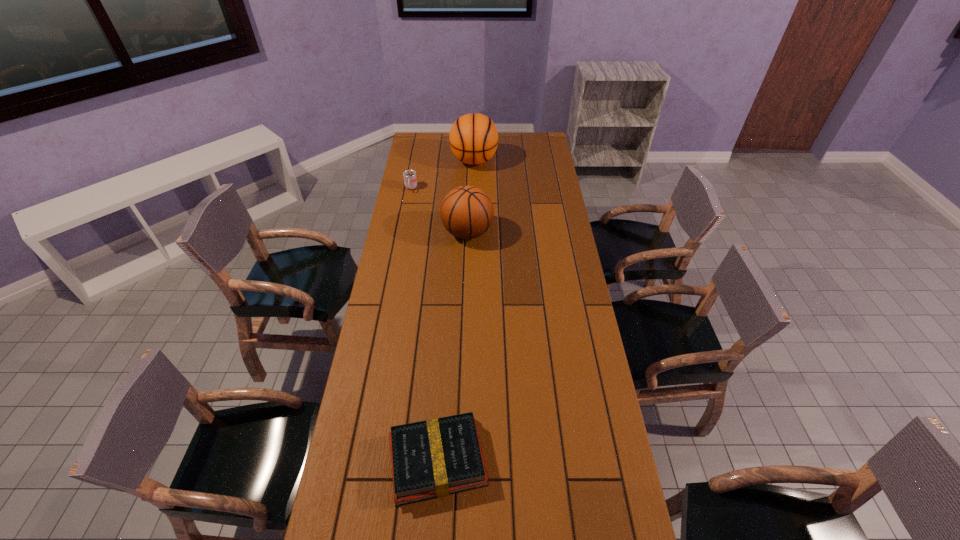
Where is `vacant point located between the hardback book and the second farthest object`? Image resolution: width=960 pixels, height=540 pixels. vacant point located between the hardback book and the second farthest object is located at coordinates (424, 324).

The image size is (960, 540). Identify the location of free area in between the nearer basketball and the leftmost object. (440, 210).

Locate an element on the screen. This screenshot has height=540, width=960. vacant area that lies between the nearest object and the second shortest object is located at coordinates (424, 324).

I want to click on free space between the farthest object and the third nearest object, so click(x=443, y=174).

Find the location of `the second closest object to the farthest object`. the second closest object to the farthest object is located at coordinates (467, 212).

Identify which object is the third nearest to the nearer basketball. Please provide its 2D coordinates. Your answer should be formatted as a tuple, i.e. [(x, y)], where the tuple contains the x and y coordinates of a point satisfying the conditions above.

[(434, 458)]

I want to click on vacant space that satisfies the following two spatial constraints: 1. on the side with the handle of the second nearest object; 2. on the left side of the third tallest object, so click(402, 232).

You are a GUI agent. You are given a task and a screenshot of the screen. Output one action in this format:
    pyautogui.click(x=<x>, y=<y>)
    Task: Click on the free space that satisfies the following two spatial constraints: 1. on the side with the handle of the leftmost object; 2. on the right side of the nearest object
    The height and width of the screenshot is (540, 960).
    Given the screenshot: What is the action you would take?
    pyautogui.click(x=360, y=460)

This screenshot has width=960, height=540. Find the location of `vacant space that satisfies the following two spatial constraints: 1. on the side with the handle of the hardback book; 2. on the left side of the cup`. vacant space that satisfies the following two spatial constraints: 1. on the side with the handle of the hardback book; 2. on the left side of the cup is located at coordinates (360, 460).

The image size is (960, 540). I want to click on free space that satisfies the following two spatial constraints: 1. on the side with the handle of the cup; 2. on the right side of the hardback book, so click(x=360, y=460).